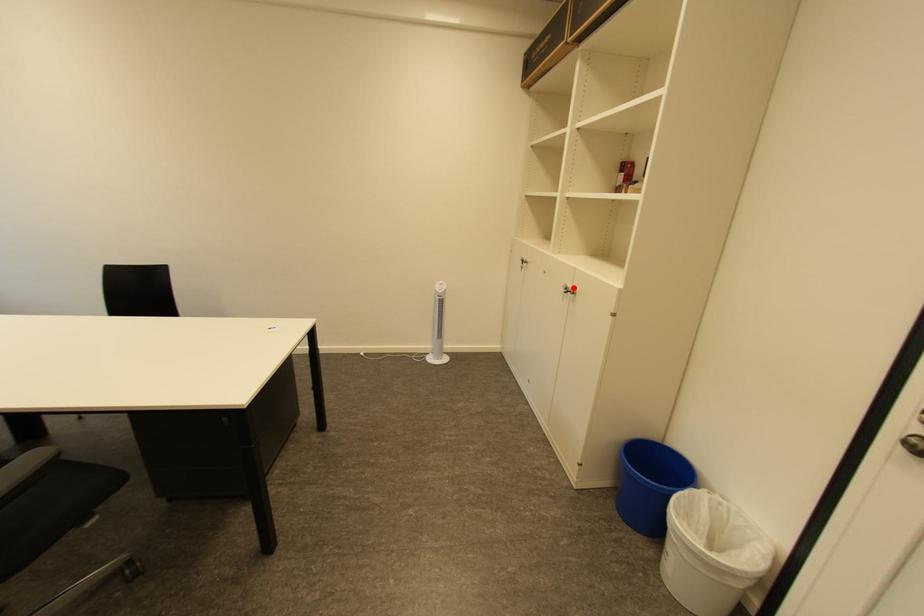
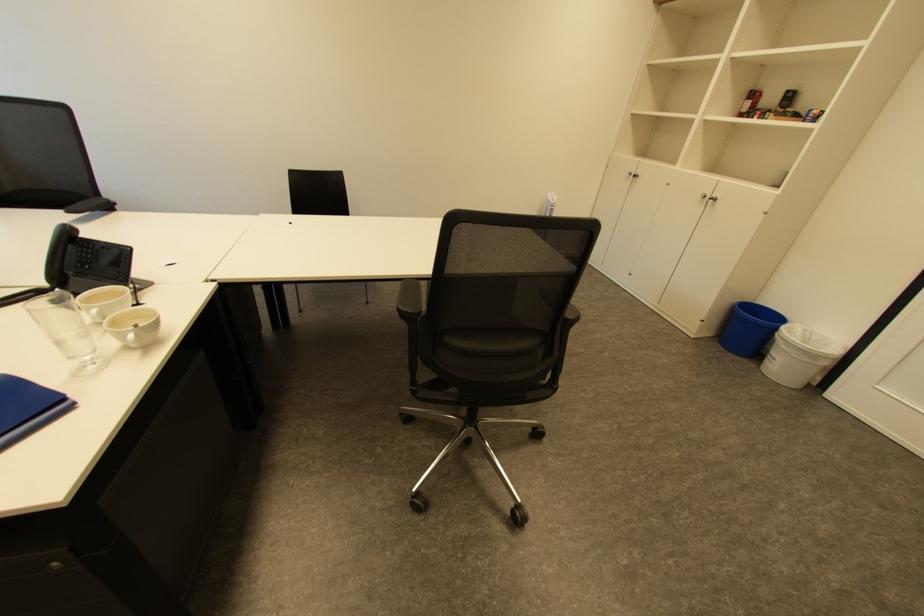
Locate, in the second image, the point that corresponds to the highlighted location in the first image.

(711, 196)